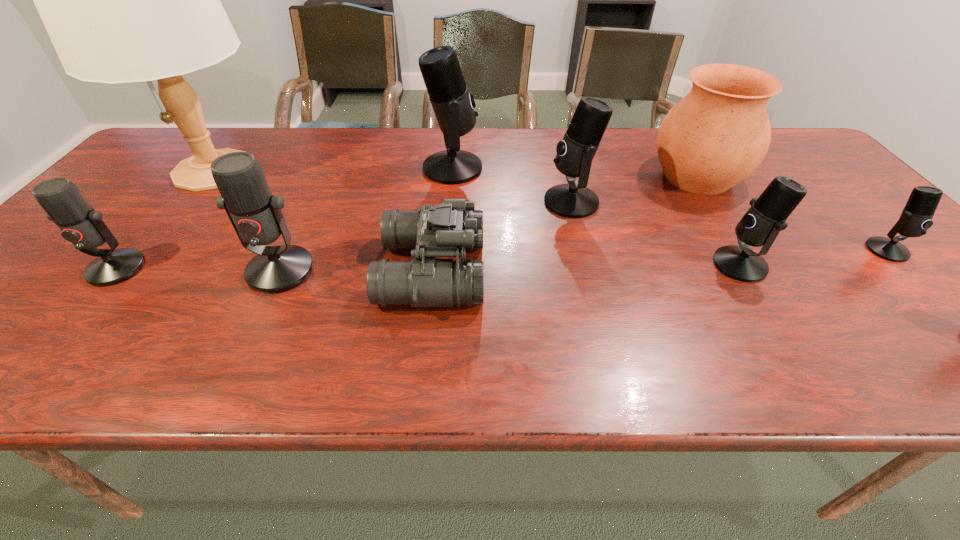
Find the location of a particular element. Image resolution: width=960 pixels, height=540 pixels. the fifth microphone from left to right is located at coordinates (761, 224).

Find the location of a particular element. the leftmost microphone is located at coordinates (65, 205).

At what (x,y) coordinates should I click in order to perform the action: click on the left red microphone. Please return your answer as a coordinate pair (x, y). Looking at the image, I should click on (65, 205).

Identify the location of the rightmost microphone. (916, 217).

The width and height of the screenshot is (960, 540). I want to click on the smallest black microphone, so click(916, 217).

Locate an element on the screen. binoculars is located at coordinates (445, 230).

At what (x,y) coordinates should I click in order to perform the action: click on vacant region located on the front of the table lamp. Please return your answer as a coordinate pair (x, y). The height and width of the screenshot is (540, 960). Looking at the image, I should click on (125, 281).

The image size is (960, 540). I want to click on free space located 0.350m on the stand of the leftmost black microphone, so click(x=604, y=168).

You are a GUI agent. You are given a task and a screenshot of the screen. Output one action in this format:
    pyautogui.click(x=<x>, y=<y>)
    Task: Click on the free spot located on the front of the pottery
    
    Given the screenshot: What is the action you would take?
    pyautogui.click(x=744, y=251)

Locate an element on the screen. Image resolution: width=960 pixels, height=540 pixels. free region located on the stand of the fourth microphone from left to right is located at coordinates 410,202.